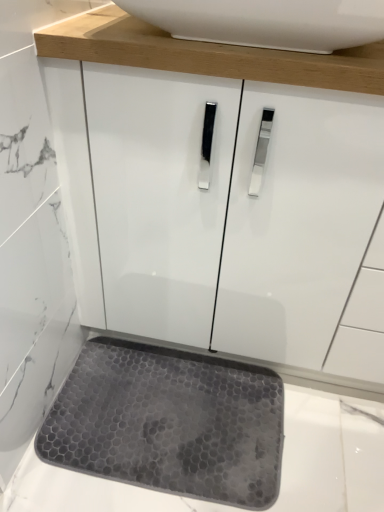
Question: Is gray rubber mat at lower center completely or partially inside white glossy sink at upper center?

Choices:
 (A) no
 (B) yes

Answer: (A)

Question: Are white glossy sink at upper center and gray rubber mat at lower center making contact?

Choices:
 (A) no
 (B) yes

Answer: (A)

Question: From a real-world perspective, is white glossy sink at upper center over gray rubber mat at lower center?

Choices:
 (A) yes
 (B) no

Answer: (A)

Question: Is white glossy sink at upper center facing away from gray rubber mat at lower center?

Choices:
 (A) yes
 (B) no

Answer: (B)

Question: Does white glossy sink at upper center have a greater height compared to gray rubber mat at lower center?

Choices:
 (A) no
 (B) yes

Answer: (B)

Question: Is the position of white glossy sink at upper center more distant than that of gray rubber mat at lower center?

Choices:
 (A) yes
 (B) no

Answer: (B)

Question: Is gray rubber mat at lower center not close to white glossy sink at upper center?

Choices:
 (A) yes
 (B) no

Answer: (B)

Question: Is gray rubber mat at lower center smaller than white glossy sink at upper center?

Choices:
 (A) yes
 (B) no

Answer: (A)

Question: Is gray rubber mat at lower center taller than white glossy sink at upper center?

Choices:
 (A) yes
 (B) no

Answer: (B)

Question: From a real-world perspective, is gray rubber mat at lower center physically below white glossy sink at upper center?

Choices:
 (A) no
 (B) yes

Answer: (B)

Question: Does gray rubber mat at lower center lie in front of white glossy sink at upper center?

Choices:
 (A) no
 (B) yes

Answer: (A)

Question: Considering the relative sizes of gray rubber mat at lower center and white glossy sink at upper center in the image provided, is gray rubber mat at lower center thinner than white glossy sink at upper center?

Choices:
 (A) no
 (B) yes

Answer: (A)

Question: Is white glossy sink at upper center spatially inside gray rubber mat at lower center, or outside of it?

Choices:
 (A) inside
 (B) outside

Answer: (B)